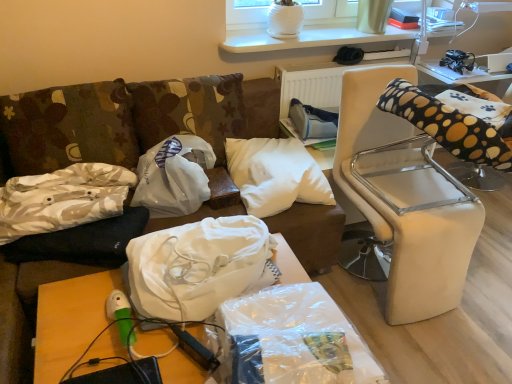
Question: From the image's perspective, is camouflage fabric pillow at left, which is the 1th pillow in left-to-right order, located above or below clear plastic table at upper right, which appears as the second table when viewed from the front?

Choices:
 (A) above
 (B) below

Answer: (B)

Question: Considering the positions of camouflage fabric pillow at left, positioned as the 3th pillow in right-to-left order, and clear plastic table at upper right, which appears as the second table when viewed from the front, in the image, is camouflage fabric pillow at left, positioned as the 3th pillow in right-to-left order, taller or shorter than clear plastic table at upper right, which appears as the second table when viewed from the front,?

Choices:
 (A) tall
 (B) short

Answer: (A)

Question: Which object is positioned farthest from the white plastic bag at center, placed as the third material when sorted from front to back?

Choices:
 (A) camouflage fabric pillow at left, positioned as the 3th pillow in right-to-left order
 (B) white soft pillow at center, acting as the 3th pillow starting from the left
 (C) camouflage fabric pillow at left, positioned as the second pillow in right-to-left order
 (D) black fabric bean bag chair at right
 (E) white fabric bag at center, which is the 2th material from front to back

Answer: (D)

Question: Which is nearer to the white plastic bag at center, placed as the third material when sorted from front to back?

Choices:
 (A) camouflage fabric pillow at left, the second pillow positioned from the left
 (B) clear plastic table at upper right, which is the 1th table in right-to-left order
 (C) clear plastic bag at lower center, the 3th material viewed from the back
 (D) white leather chair at right
 (E) wooden table at lower left, the 2th table from the back

Answer: (A)